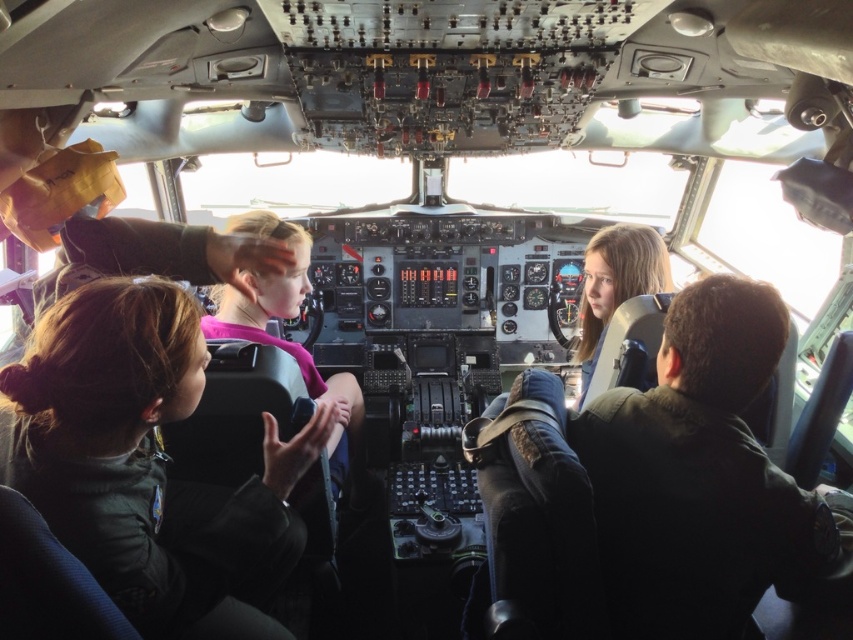
Looking at this image, can you confirm if dark green uniform at left is positioned below dark brown leather jacket at center?

Yes.

Is the position of dark green uniform at left less distant than that of dark brown leather jacket at center?

Yes, it is in front of dark brown leather jacket at center.

The height and width of the screenshot is (640, 853). Find the location of `dark green uniform at left`. dark green uniform at left is located at coordinates (144, 461).

Between point (753, 524) and point (305, 385), which one is positioned in front?

Positioned in front is point (753, 524).

Which of these two, dark brown leather jacket at center or pink fabric shirt at center, stands shorter?

dark brown leather jacket at center is shorter.

Where is `dark brown leather jacket at center`? dark brown leather jacket at center is located at coordinates (705, 481).

The image size is (853, 640). Find the location of `dark brown leather jacket at center`. dark brown leather jacket at center is located at coordinates (705, 481).

Is dark green uniform at left smaller than pink fabric shirt at center?

Correct, dark green uniform at left occupies less space than pink fabric shirt at center.

Is dark green uniform at left taller than pink fabric shirt at center?

In fact, dark green uniform at left may be shorter than pink fabric shirt at center.

Is point (64, 321) farther from camera compared to point (352, 428)?

No, (64, 321) is in front of (352, 428).

Identify the location of dark green uniform at left. The image size is (853, 640). (144, 461).